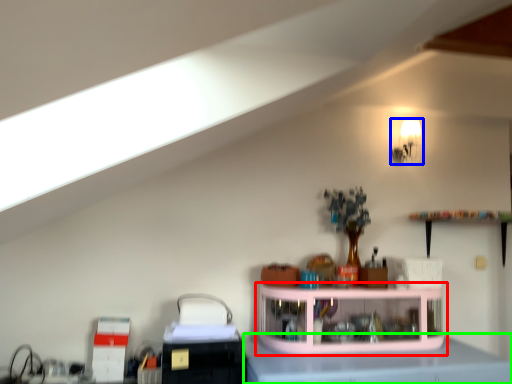
Question: Which is nearer to the shelf (highlighted by a red box)? light fixture (highlighted by a blue box) or counter top (highlighted by a green box).

Choices:
 (A) light fixture
 (B) counter top

Answer: (B)